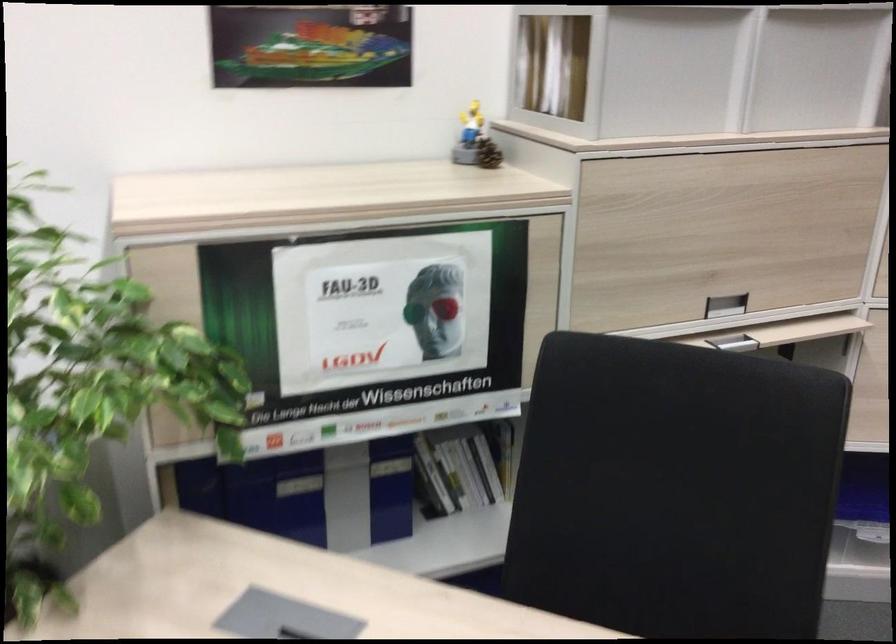
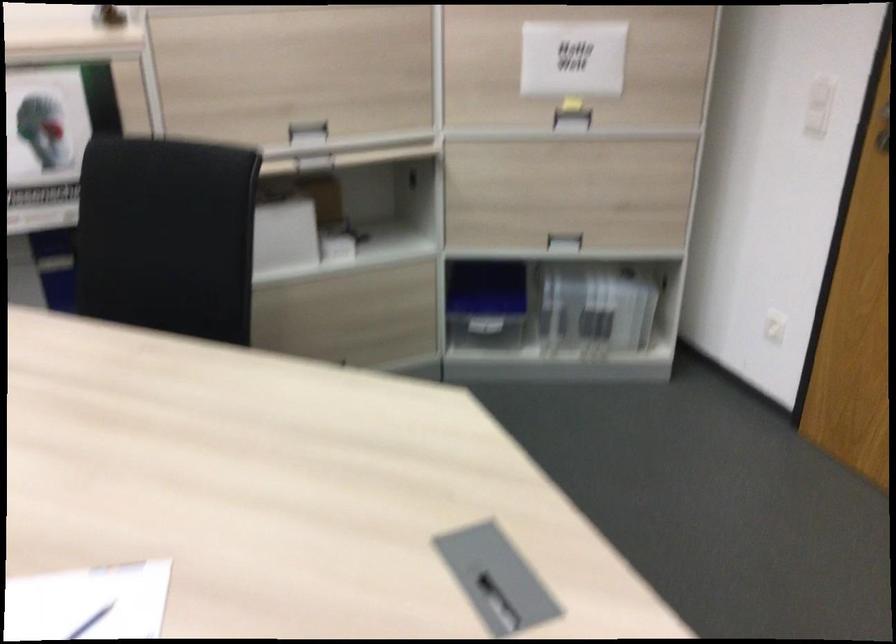
Where in the second image is the point corresponding to point (727, 341) from the first image?

(314, 164)